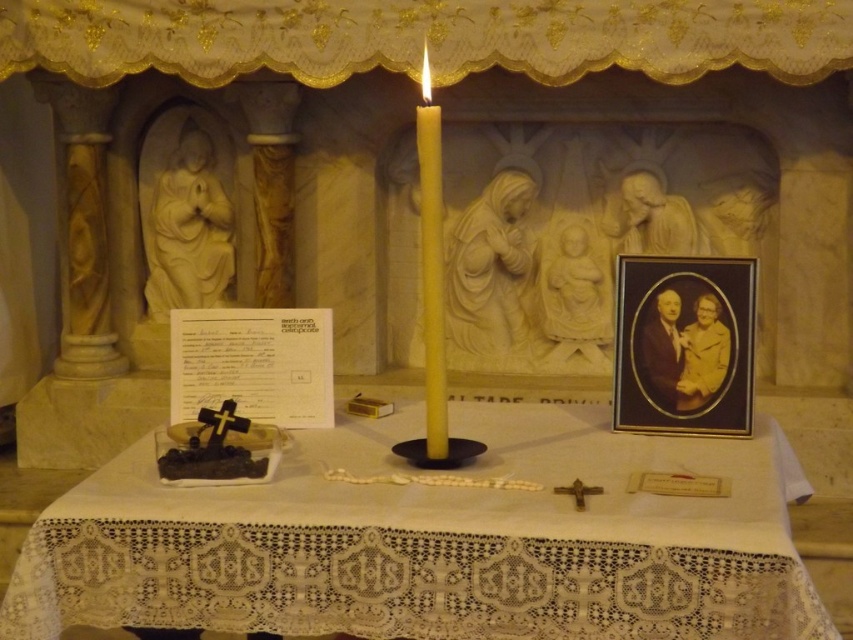
You are an interior designer planning to place a new decorative item on the altar. The item you have in mind is slightly smaller than the white marble statue at upper left. Where on the altar would you position this new item to maintain balance with the yellow wax candle at center?

Since the white marble statue at upper left is larger in size than the yellow wax candle at center, positioning the new item, which is smaller than the statue, on the right side of the candle would help balance the composition by counterbalancing the larger statue on the left.

You are an interior designer planning to adjust the layout of the altar. You want to place a new decorative item between the white lace tablecloth at center and the white marble statue at upper left. Based on their sizes, which object should the new item be placed closer to?

The white lace tablecloth at center is not as tall as the white marble statue at upper left, so the new decorative item should be placed closer to the white lace tablecloth at center to maintain balance in the layout.

You are standing in front of the altar and want to place a small offering. The altar has two points marked as point (157, 161) and point (428, 124). Which point is closer to you?

Point (428, 124) is closer to you because point (157, 161) is behind it.